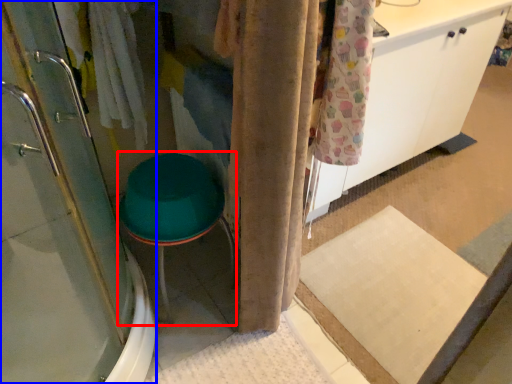
Question: Which object appears closest to the camera in this image, step stool (highlighted by a red box) or shower door (highlighted by a blue box)?

Choices:
 (A) step stool
 (B) shower door

Answer: (B)